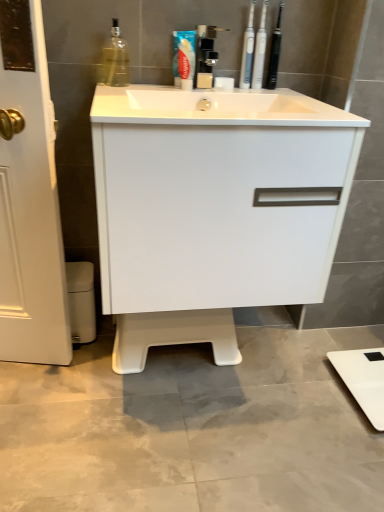
Where is `free space in front of white plastic toothbrushes at upper right, which is the first toiletry from left to right`? The width and height of the screenshot is (384, 512). free space in front of white plastic toothbrushes at upper right, which is the first toiletry from left to right is located at coordinates (258, 95).